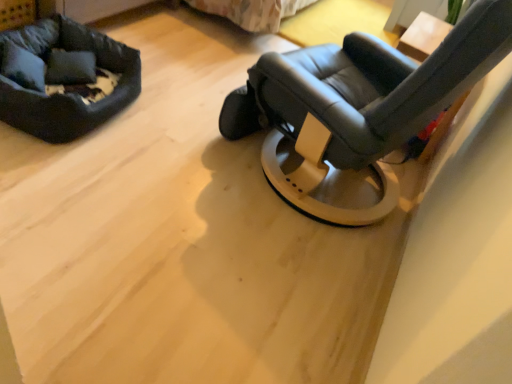
Question: Is soft black fabric dog bed at upper left positioned before soft gray fabric pillow at upper left?

Choices:
 (A) yes
 (B) no

Answer: (A)

Question: Is soft black fabric dog bed at upper left looking in the opposite direction of soft gray fabric pillow at upper left?

Choices:
 (A) no
 (B) yes

Answer: (B)

Question: Is the depth of soft black fabric dog bed at upper left greater than that of soft gray fabric pillow at upper left?

Choices:
 (A) no
 (B) yes

Answer: (A)

Question: Is soft black fabric dog bed at upper left at the left side of soft gray fabric pillow at upper left?

Choices:
 (A) no
 (B) yes

Answer: (B)

Question: Can you confirm if soft black fabric dog bed at upper left is taller than soft gray fabric pillow at upper left?

Choices:
 (A) yes
 (B) no

Answer: (A)

Question: From the image's perspective, is matte black chair at center above or below soft gray fabric pillow at upper left?

Choices:
 (A) above
 (B) below

Answer: (B)

Question: Choose the correct answer: Is matte black chair at center inside soft gray fabric pillow at upper left or outside it?

Choices:
 (A) inside
 (B) outside

Answer: (B)

Question: From a real-world perspective, is matte black chair at center above or below soft gray fabric pillow at upper left?

Choices:
 (A) below
 (B) above

Answer: (B)

Question: In the image, is matte black chair at center positioned in front of or behind soft gray fabric pillow at upper left?

Choices:
 (A) behind
 (B) front

Answer: (B)

Question: Considering the positions of point (80, 82) and point (316, 59), is point (80, 82) closer or farther from the camera than point (316, 59)?

Choices:
 (A) farther
 (B) closer

Answer: (A)

Question: Is soft gray fabric pillow at upper left to the left or to the right of matte black chair at center in the image?

Choices:
 (A) left
 (B) right

Answer: (A)

Question: Looking at their shapes, would you say soft gray fabric pillow at upper left is wider or thinner than matte black chair at center?

Choices:
 (A) wide
 (B) thin

Answer: (B)

Question: From the image's perspective, is soft gray fabric pillow at upper left located above or below matte black chair at center?

Choices:
 (A) above
 (B) below

Answer: (A)

Question: Is wooden table at upper right to the left or to the right of soft black fabric dog bed at upper left in the image?

Choices:
 (A) right
 (B) left

Answer: (A)

Question: Choose the correct answer: Is wooden table at upper right inside soft black fabric dog bed at upper left or outside it?

Choices:
 (A) inside
 (B) outside

Answer: (B)